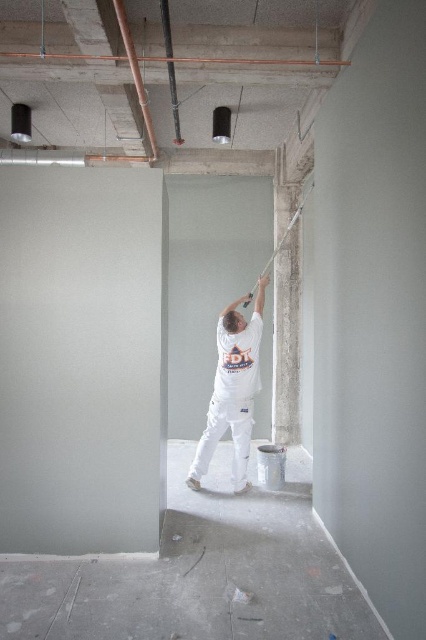
Is copper pipe at upper left to the right of matte black pipe at upper center from the viewer's perspective?

In fact, copper pipe at upper left is to the left of matte black pipe at upper center.

Between point (146, 116) and point (169, 68), which one is positioned behind?

The point (146, 116) is more distant.

At what (x,y) coordinates should I click in order to perform the action: click on copper pipe at upper left. Please return your answer as a coordinate pair (x, y). Looking at the image, I should click on (135, 74).

Between point (233, 406) and point (132, 42), which one is positioned behind?

The point (233, 406) is behind.

Consider the image. Is white matte/latex shirt at center bigger than copper pipe at upper left?

Yes, white matte/latex shirt at center is bigger than copper pipe at upper left.

Which is in front, point (218, 388) or point (132, 45)?

Point (132, 45)

This screenshot has height=640, width=426. In order to click on white matte/latex shirt at center in this screenshot , I will do `click(233, 388)`.

Which of these two, white matte/latex shirt at center or matte black pipe at upper center, stands taller?

white matte/latex shirt at center is taller.

Between point (253, 397) and point (178, 122), which one is positioned in front?

Positioned in front is point (178, 122).

Image resolution: width=426 pixels, height=640 pixels. I want to click on white matte/latex shirt at center, so coord(233,388).